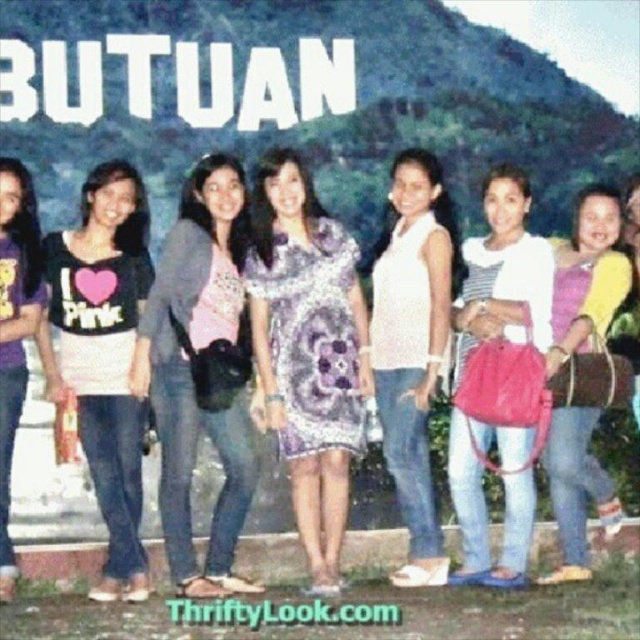
Question: Is matte black t-shirt at center closer to the viewer compared to matte black t-shirt at left?

Choices:
 (A) yes
 (B) no

Answer: (B)

Question: Which point is farther to the camera?

Choices:
 (A) (148, 365)
 (B) (580, 508)
 (C) (410, 339)
 (D) (36, 280)

Answer: (B)

Question: Is the position of matte gray sweater at center less distant than that of white matte tank top at center?

Choices:
 (A) no
 (B) yes

Answer: (B)

Question: Which object appears farthest from the camera in this image?

Choices:
 (A) purple printed dress at center
 (B) pink fabric dress at center
 (C) white matte tank top at center
 (D) matte black t-shirt at center

Answer: (B)

Question: Estimate the real-world distances between objects in this image. Which object is closer to the matte black t-shirt at center?

Choices:
 (A) matte black t-shirt at left
 (B) white matte tank top at center

Answer: (A)

Question: Is matte gray sweater at center positioned at the back of white matte tank top at center?

Choices:
 (A) yes
 (B) no

Answer: (B)